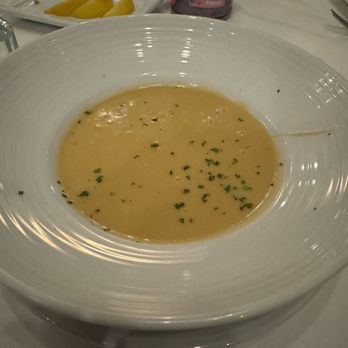
Where is `soup bowl`? soup bowl is located at coordinates (109, 283).